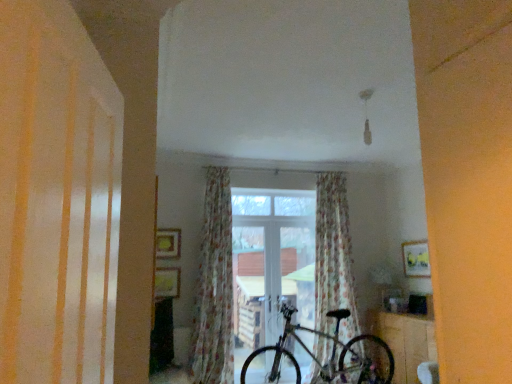
Question: Can you confirm if wooden table at lower right is thinner than shiny metallic bicycle at center?

Choices:
 (A) no
 (B) yes

Answer: (B)

Question: Does wooden table at lower right have a greater width compared to shiny metallic bicycle at center?

Choices:
 (A) no
 (B) yes

Answer: (A)

Question: Is wooden table at lower right looking in the opposite direction of shiny metallic bicycle at center?

Choices:
 (A) yes
 (B) no

Answer: (B)

Question: Are wooden table at lower right and shiny metallic bicycle at center making contact?

Choices:
 (A) yes
 (B) no

Answer: (B)

Question: Can you confirm if wooden table at lower right is shorter than shiny metallic bicycle at center?

Choices:
 (A) yes
 (B) no

Answer: (A)

Question: Choose the correct answer: Is wooden table at lower right inside shiny metallic bicycle at center or outside it?

Choices:
 (A) outside
 (B) inside

Answer: (A)

Question: Looking at their shapes, would you say wooden table at lower right is wider or thinner than shiny metallic bicycle at center?

Choices:
 (A) thin
 (B) wide

Answer: (A)

Question: Is point (416, 327) closer or farther from the camera than point (370, 367)?

Choices:
 (A) closer
 (B) farther

Answer: (A)

Question: Considering the positions of wooden table at lower right and shiny metallic bicycle at center in the image, is wooden table at lower right taller or shorter than shiny metallic bicycle at center?

Choices:
 (A) short
 (B) tall

Answer: (A)

Question: Is point [349, 251] positioned closer to the camera than point [112, 215]?

Choices:
 (A) farther
 (B) closer

Answer: (A)

Question: Considering their positions, is floral fabric curtain at center, the 1th curtain positioned from the right, located in front of or behind white glossy shutter at left?

Choices:
 (A) front
 (B) behind

Answer: (B)

Question: Looking at the image, does floral fabric curtain at center, acting as the second curtain starting from the left, seem bigger or smaller compared to white glossy shutter at left?

Choices:
 (A) big
 (B) small

Answer: (A)

Question: Is floral fabric curtain at center, acting as the second curtain starting from the left, inside or outside of white glossy shutter at left?

Choices:
 (A) inside
 (B) outside

Answer: (B)

Question: Visually, is white glossy shutter at left positioned to the left or to the right of wooden table at lower right?

Choices:
 (A) right
 (B) left

Answer: (B)

Question: Is point (72, 8) positioned closer to the camera than point (415, 344)?

Choices:
 (A) closer
 (B) farther

Answer: (A)